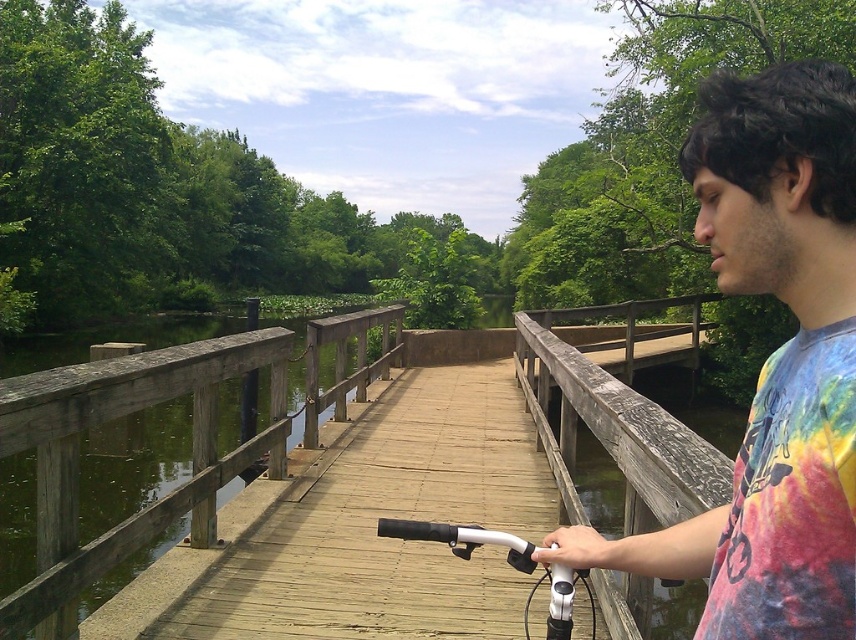
You are a painter standing on the wooden bridge and want to capture the view of the green wood waterway at center and the weathered wood rail at center in your painting. Which object should you focus on first if you want to paint the one that is closer to you?

The green wood waterway at center is closer to you than the weathered wood rail at center, so you should focus on painting the green wood waterway at center first.